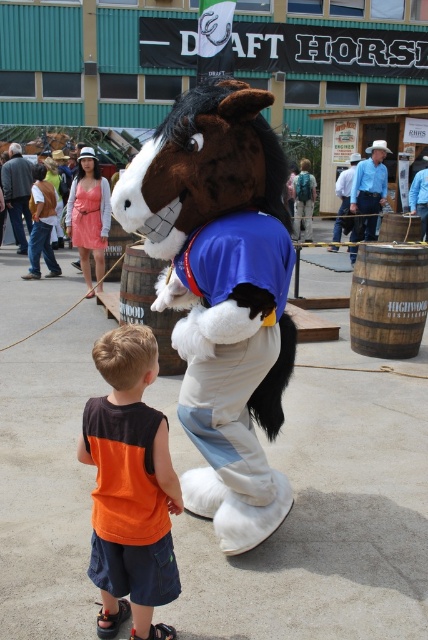
Is brown plush horse at center thinner than orange fabric shirt at lower left?

In fact, brown plush horse at center might be wider than orange fabric shirt at lower left.

The image size is (428, 640). What do you see at coordinates (219, 294) in the screenshot?
I see `brown plush horse at center` at bounding box center [219, 294].

The height and width of the screenshot is (640, 428). I want to click on brown plush horse at center, so click(x=219, y=294).